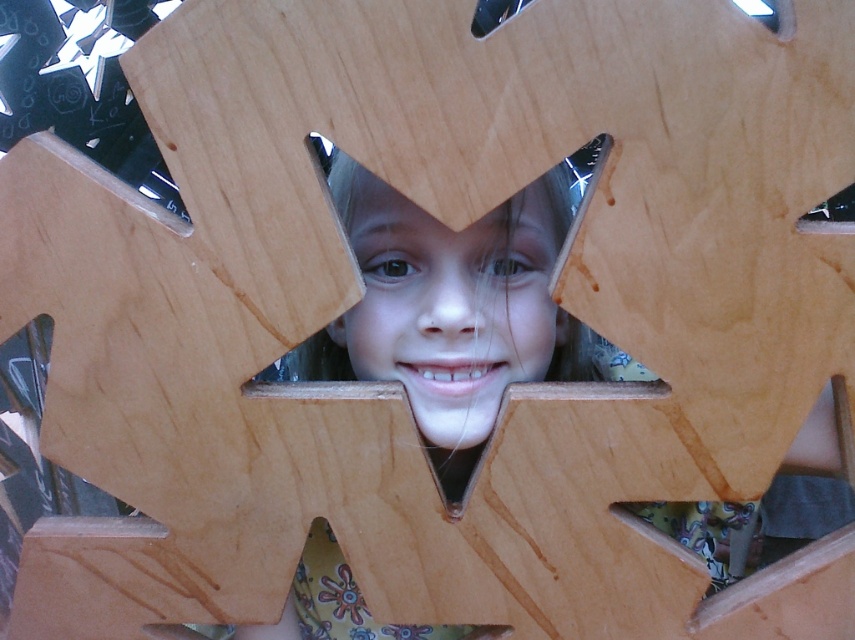
You are a child trying to find the clear plastic triangle at center and the metallic silver at upper center in the wooden snowflake. Which one do you think is bigger?

The clear plastic triangle at center is larger in size compared to the metallic silver at upper center.

You are a photographer trying to focus on two points in the image. The first point is point (428, 260) and the second point is point (836, 220). Which point is closer to you?

Point (428, 260) is closer to the viewer than point (836, 220).

You are a child trying to see through the clear plastic triangle at center. Can you see the matte wood face at center through it?

The matte wood face at center is bigger than clear plastic triangle at center, so the clear plastic triangle at center is smaller and may not fully cover the matte wood face at center. However, since the clear plastic triangle at center is transparent, you can still see the matte wood face at center through it.